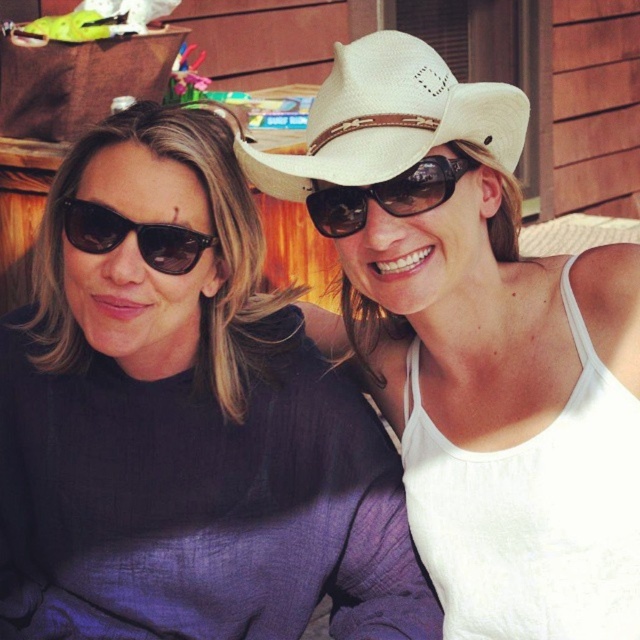
You are a photographer setting up for a group photo. You have to position the matte black sweater at left and the white straw cowboy hat at upper center so that both are clearly visible in the frame. Considering their sizes, which object should you ensure is placed closer to the camera to avoid being obscured?

The white straw cowboy hat at upper center should be placed closer to the camera because it is smaller in size compared to the matte black sweater at left, ensuring it remains visible without being obscured.

You are organizing a clothing display and need to arrange the matte black sweater at left and the white straw hat at upper center side by side. Which item should you place first if you want to follow the order from wider to narrower?

The matte black sweater at left should be placed first because its width surpasses the white straw hat at upper center, making it wider.